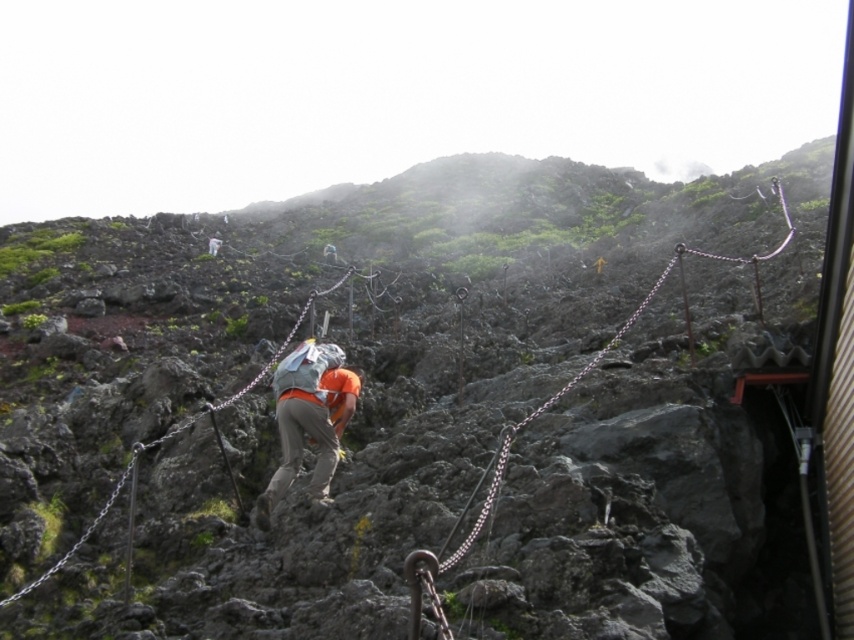
Question: Which point is closer to the camera?

Choices:
 (A) rusty chain at upper center
 (B) metallic chain at center
 (C) orange fabric backpack at center

Answer: (A)

Question: Is the position of orange fabric backpack at center more distant than that of rusty chain at upper center?

Choices:
 (A) yes
 (B) no

Answer: (A)

Question: Is orange fabric backpack at center closer to camera compared to rusty chain at upper center?

Choices:
 (A) yes
 (B) no

Answer: (B)

Question: Which of the following is the farthest from the observer?

Choices:
 (A) metallic chain at center
 (B) orange fabric backpack at center

Answer: (B)

Question: Is orange fabric backpack at center wider than metallic chain at center?

Choices:
 (A) no
 (B) yes

Answer: (A)

Question: Which of the following is the closest to the observer?

Choices:
 (A) rusty chain at upper center
 (B) metallic chain at center

Answer: (A)